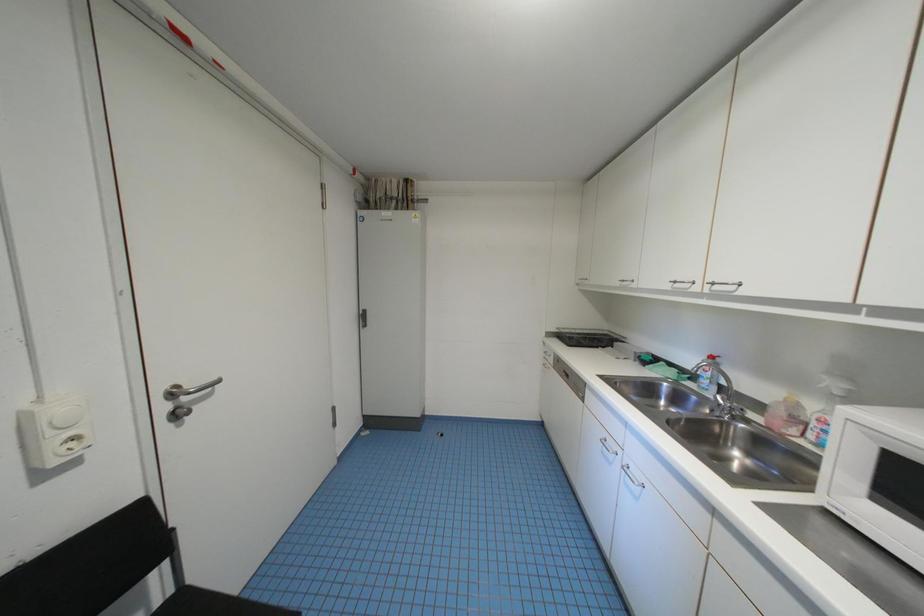
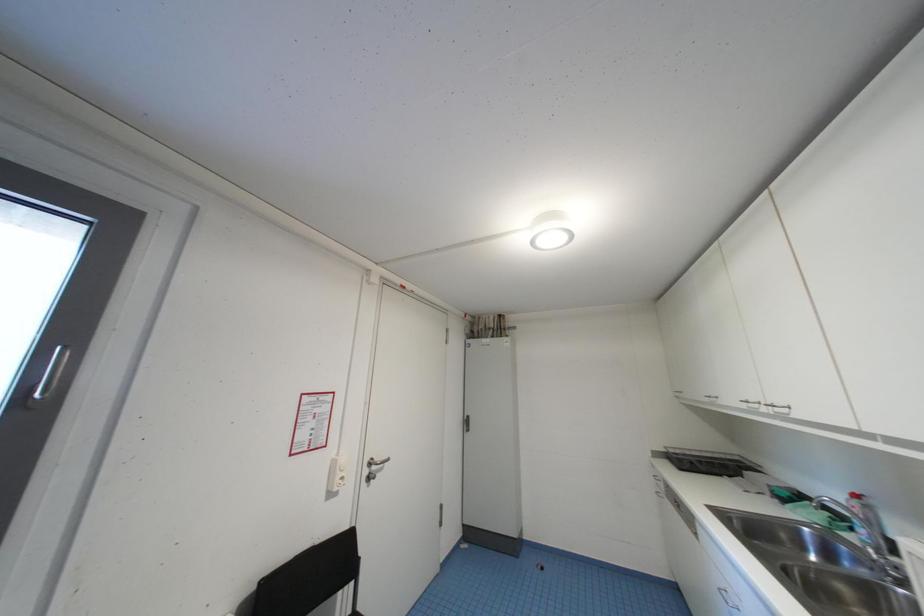
Based on the continuous images, in which direction is the camera rotating?

The camera rotated toward left-up.